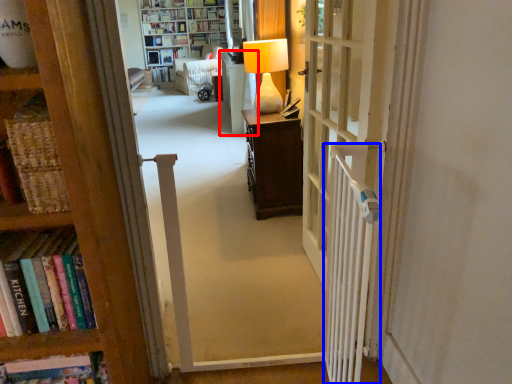
Question: Among these objects, which one is nearest to the camera, furniture (highlighted by a red box) or radiator (highlighted by a blue box)?

Choices:
 (A) furniture
 (B) radiator

Answer: (B)